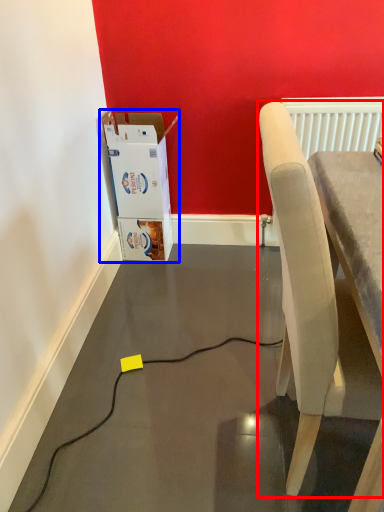
Question: Among these objects, which one is nearest to the camera, chair (highlighted by a red box) or cardboard box (highlighted by a blue box)?

Choices:
 (A) chair
 (B) cardboard box

Answer: (A)